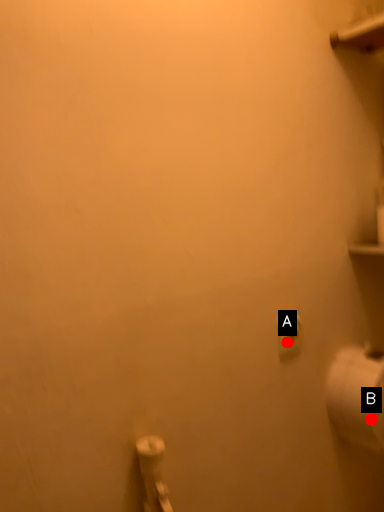
Question: Two points are circled on the image, labeled by A and B beside each circle. Which point is farther from the camera taking this photo?

Choices:
 (A) A is further
 (B) B is further

Answer: (B)